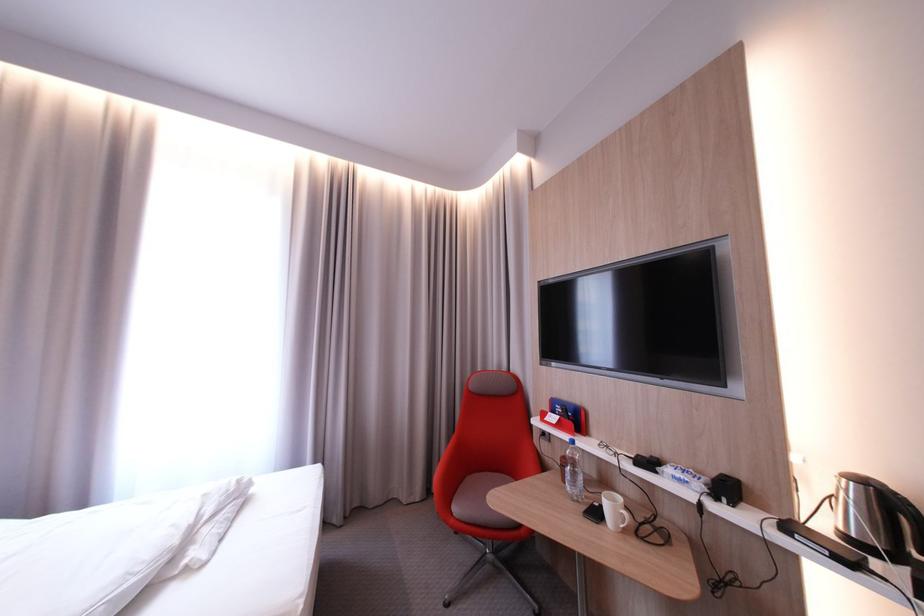
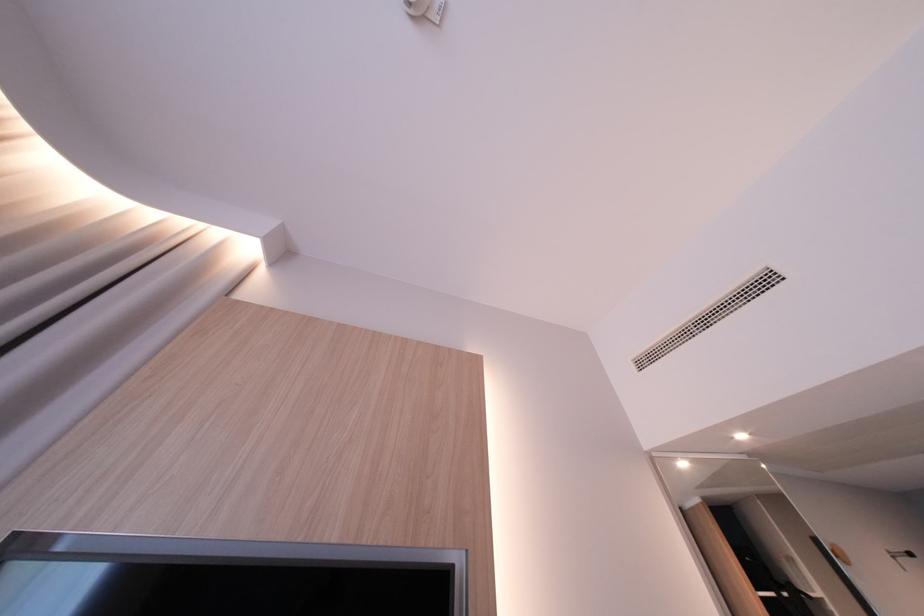
First-person continuous shooting, in which direction is the camera rotating?

The camera rotated toward right-up.